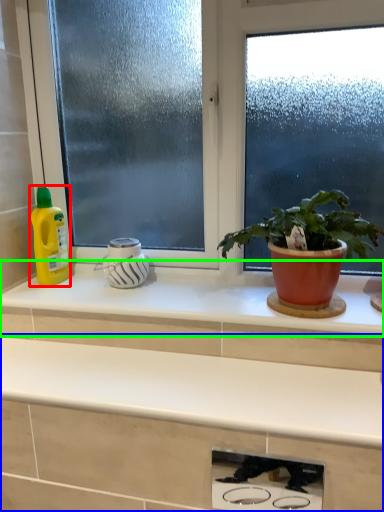
Question: Which object is the farthest from cleaning product (highlighted by a red box)? Choose among these: countertop (highlighted by a blue box) or countertop (highlighted by a green box).

Choices:
 (A) countertop
 (B) countertop

Answer: (A)